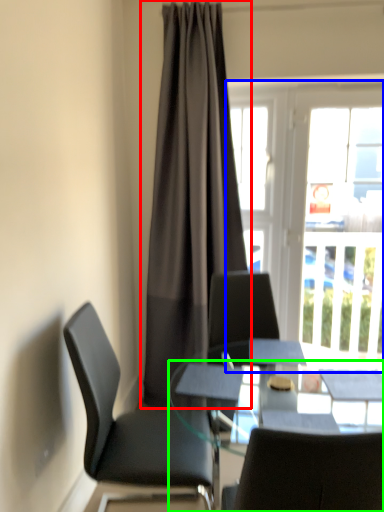
Question: Which object is the closest to the curtain (highlighted by a red box)? Choose among these: window (highlighted by a blue box) or desk (highlighted by a green box).

Choices:
 (A) window
 (B) desk

Answer: (A)